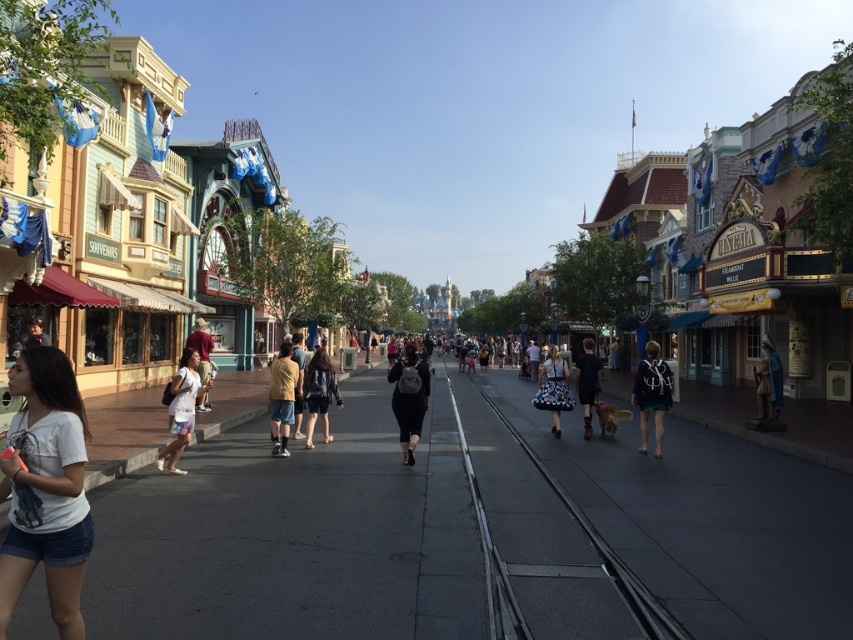
Based on the photo, you are a photographer standing in the lively theme park street scene. You notice a person wearing a green matte skirt at center and a denim jacket at center. From the photographer perspective, which clothing item is located to the right?

The green matte skirt at center is positioned on the right side of the denim jacket at center, so from the photographer perspective, the green matte skirt at center is located to the right of the denim jacket at center.

You are a photographer standing on the lively street scene in the theme park. You want to take a photo that includes both the green matte skirt at center and the white cotton dress at lower left. Which object should you ensure is placed higher in the frame to include both properly?

The green matte skirt at center is much taller than the white cotton dress at lower left, so you should ensure the green matte skirt at center is placed higher in the frame to include both properly.

You are a photographer positioned on the street and want to capture both the green matte skirt at center and the white cotton dress at lower left in a single shot. Which one should you focus on first to ensure both are in focus?

You should focus on the green matte skirt at center first because it is closer to you than the white cotton dress at lower left, ensuring both will be in focus when using a camera with depth of field adjustments.